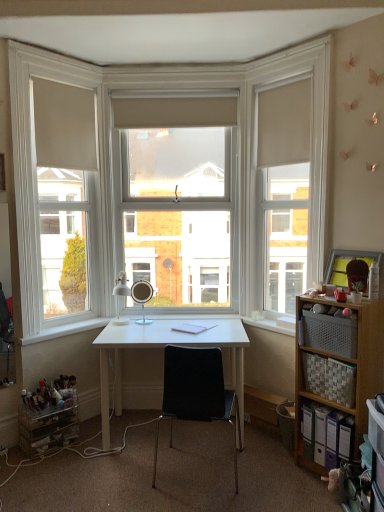
Identify the location of white matte window frame at left, marked as the 2th window frame in a right-to-left arrangement. (37, 197).

Measure the distance between matte white table lamp at center, positioned as the 1th table lamp in left-to-right order, and camera.

matte white table lamp at center, positioned as the 1th table lamp in left-to-right order, and camera are 3.13 meters apart.

Image resolution: width=384 pixels, height=512 pixels. Find the location of `wooden shelf at right, marked as the 1th shelf in a bottom-to-top arrangement`. wooden shelf at right, marked as the 1th shelf in a bottom-to-top arrangement is located at coordinates (349, 362).

Locate an element on the screen. This screenshot has width=384, height=512. satin silver mirror at center, which ranks as the second table lamp in left-to-right order is located at coordinates point(142,297).

What do you see at coordinates (196, 393) in the screenshot?
I see `black plastic chair at center` at bounding box center [196, 393].

Where is `white matte window frame at left, the first window frame from the left`? The width and height of the screenshot is (384, 512). white matte window frame at left, the first window frame from the left is located at coordinates (37, 197).

Could you tell me if white glossy desk at center is facing clear glass window at center?

No, white glossy desk at center is not turned towards clear glass window at center.

Which is farther, [228,320] or [225,150]?

The point [225,150] is behind.

Is white glossy desk at center far away from clear glass window at center?

That's right, there is a large distance between white glossy desk at center and clear glass window at center.

Is wooden shelf at right, marked as the 1th shelf in a bottom-to-top arrangement, located within black plastic chair at center?

No, black plastic chair at center does not contain wooden shelf at right, marked as the 1th shelf in a bottom-to-top arrangement.

In the image, is black plastic chair at center positioned in front of or behind wooden shelf at right, marked as the 1th shelf in a bottom-to-top arrangement?

black plastic chair at center is positioned closer to the viewer than wooden shelf at right, marked as the 1th shelf in a bottom-to-top arrangement.

From the image's perspective, is black plastic chair at center over wooden shelf at right, the second shelf when ordered from top to bottom?

Actually, black plastic chair at center appears below wooden shelf at right, the second shelf when ordered from top to bottom, in the image.

Does wooden shelf at right, marked as the 1th shelf in a bottom-to-top arrangement, appear on the right side of white wood frame at upper center, arranged as the second window frame when viewed from the left?

Indeed, wooden shelf at right, marked as the 1th shelf in a bottom-to-top arrangement, is positioned on the right side of white wood frame at upper center, arranged as the second window frame when viewed from the left.

From a real-world perspective, is wooden shelf at right, marked as the 1th shelf in a bottom-to-top arrangement, located beneath white wood frame at upper center, arranged as the second window frame when viewed from the left?

Yes, from a real-world perspective, wooden shelf at right, marked as the 1th shelf in a bottom-to-top arrangement, is beneath white wood frame at upper center, arranged as the second window frame when viewed from the left.

Can you confirm if wooden shelf at right, marked as the 1th shelf in a bottom-to-top arrangement, is shorter than white wood frame at upper center, arranged as the second window frame when viewed from the left?

Yes, wooden shelf at right, marked as the 1th shelf in a bottom-to-top arrangement, is shorter than white wood frame at upper center, arranged as the second window frame when viewed from the left.

Considering the sizes of clear glass window at center and matte white table lamp at center, positioned as the 1th table lamp in left-to-right order, in the image, is clear glass window at center wider or thinner than matte white table lamp at center, positioned as the 1th table lamp in left-to-right order,?

Clearly, clear glass window at center has less width compared to matte white table lamp at center, positioned as the 1th table lamp in left-to-right order.

Considering the relative sizes of clear glass window at center and matte white table lamp at center, positioned as the 1th table lamp in left-to-right order, in the image provided, is clear glass window at center taller than matte white table lamp at center, positioned as the 1th table lamp in left-to-right order,?

Correct, clear glass window at center is much taller as matte white table lamp at center, positioned as the 1th table lamp in left-to-right order.

I want to click on table lamp that is in front of the clear glass window at center, so click(121, 296).

Is there a large distance between woven fabric basket at right and woven fabric basket at right, placed as the 2th shelf when sorted from bottom to top?

No, there isn't a large distance between woven fabric basket at right and woven fabric basket at right, placed as the 2th shelf when sorted from bottom to top.

Which is in front, point (325, 336) or point (343, 382)?

The point (343, 382) is more forward.

Which of these two, woven fabric basket at right or woven fabric basket at right, placed as the 2th shelf when sorted from bottom to top, stands shorter?

woven fabric basket at right.

How different are the orientations of woven fabric basket at right and woven fabric basket at right, the 1th shelf in the top-to-bottom sequence, in degrees?

The facing directions of woven fabric basket at right and woven fabric basket at right, the 1th shelf in the top-to-bottom sequence, are 1.98 degrees apart.

Are clear glass window at center and white wood frame at upper center, arranged as the second window frame when viewed from the left, far apart?

That's right, there is a large distance between clear glass window at center and white wood frame at upper center, arranged as the second window frame when viewed from the left.

Considering the sizes of objects clear glass window at center and white wood frame at upper center, arranged as the second window frame when viewed from the left, in the image provided, who is smaller, clear glass window at center or white wood frame at upper center, arranged as the second window frame when viewed from the left,?

white wood frame at upper center, arranged as the second window frame when viewed from the left.

Considering the positions of point (124, 113) and point (241, 205), is point (124, 113) closer or farther from the camera than point (241, 205)?

Point (124, 113).

From the picture: Does black plastic chair at center have a lesser height compared to white matte window frame at left, marked as the 2th window frame in a right-to-left arrangement?

Yes.

Identify the location of chair that is below the white matte window frame at left, marked as the 2th window frame in a right-to-left arrangement (from the image's perspective). (196, 393).

Is black plastic chair at center surrounding white matte window frame at left, the first window frame from the left?

Definitely not — white matte window frame at left, the first window frame from the left, is not inside black plastic chair at center.

Does point (179, 386) appear closer or farther from the camera than point (91, 317)?

Point (179, 386) appears to be closer to the viewer than point (91, 317).

Locate an element on the screen. This screenshot has height=512, width=384. window above the white glossy desk at center (from a real-world perspective) is located at coordinates (180, 197).

Which shelf is the 1st one when counting from the right side of the black plastic chair at center? Please provide its 2D coordinates.

[(349, 362)]

From the image, which object appears to be nearer to white glossy desk at center, wooden shelf at right, the second shelf when ordered from top to bottom, or matte white table lamp at center, positioned as the 1th table lamp in left-to-right order?

Among the two, matte white table lamp at center, positioned as the 1th table lamp in left-to-right order, is located nearer to white glossy desk at center.

Looking at the image, which one is located further to white glossy desk at center, white matte window frame at left, marked as the 2th window frame in a right-to-left arrangement, or satin silver mirror at center, the first table lamp positioned from the right?

white matte window frame at left, marked as the 2th window frame in a right-to-left arrangement, is further to white glossy desk at center.

Considering their positions, is white glossy desk at center positioned further to woven fabric basket at right than white matte window frame at left, marked as the 2th window frame in a right-to-left arrangement?

Based on the image, white matte window frame at left, marked as the 2th window frame in a right-to-left arrangement, appears to be further to woven fabric basket at right.

Based on their spatial positions, is black plastic chair at center or clear glass window at center closer to wooden shelf at right, the second shelf when ordered from top to bottom?

black plastic chair at center is closer to wooden shelf at right, the second shelf when ordered from top to bottom.

Estimate the real-world distances between objects in this image. Which object is further from matte white table lamp at center, positioned as the 1th table lamp in left-to-right order, woven fabric basket at right or satin silver mirror at center, which ranks as the second table lamp in left-to-right order?

woven fabric basket at right is positioned further to the anchor matte white table lamp at center, positioned as the 1th table lamp in left-to-right order.

From the image, which object appears to be nearer to wooden shelf at right, the second shelf when ordered from top to bottom, matte white table lamp at center, positioned as the 1th table lamp in left-to-right order, or woven fabric basket at right?

woven fabric basket at right.

Looking at the image, which one is located further to clear glass window at center, black plastic chair at center or white wood frame at upper center, marked as the first window frame in a right-to-left arrangement?

black plastic chair at center is positioned further to the anchor clear glass window at center.

Estimate the real-world distances between objects in this image. Which object is further from wooden shelf at right, the second shelf when ordered from top to bottom, white wood frame at upper center, marked as the first window frame in a right-to-left arrangement, or woven fabric basket at right?

white wood frame at upper center, marked as the first window frame in a right-to-left arrangement, lies further to wooden shelf at right, the second shelf when ordered from top to bottom, than the other object.

Locate an element on the screen. The width and height of the screenshot is (384, 512). drawer that lies between clear glass window at center and white glossy desk at center from top to bottom is located at coordinates (331, 334).

Where is `window frame between white matte window frame at left, the first window frame from the left, and wooden shelf at right, marked as the 1th shelf in a bottom-to-top arrangement, in the horizontal direction`? This screenshot has height=512, width=384. window frame between white matte window frame at left, the first window frame from the left, and wooden shelf at right, marked as the 1th shelf in a bottom-to-top arrangement, in the horizontal direction is located at coordinates (257, 159).

The height and width of the screenshot is (512, 384). I want to click on window situated between satin silver mirror at center, which ranks as the second table lamp in left-to-right order, and wooden shelf at right, marked as the 1th shelf in a bottom-to-top arrangement, from left to right, so click(x=180, y=197).

You are a GUI agent. You are given a task and a screenshot of the screen. Output one action in this format:
    pyautogui.click(x=<x>, y=<y>)
    Task: Click on the chair between white matte window frame at left, the first window frame from the left, and woven fabric basket at right, the 1th shelf in the top-to-bottom sequence, in the horizontal direction
    The image size is (384, 512).
    Given the screenshot: What is the action you would take?
    pyautogui.click(x=196, y=393)